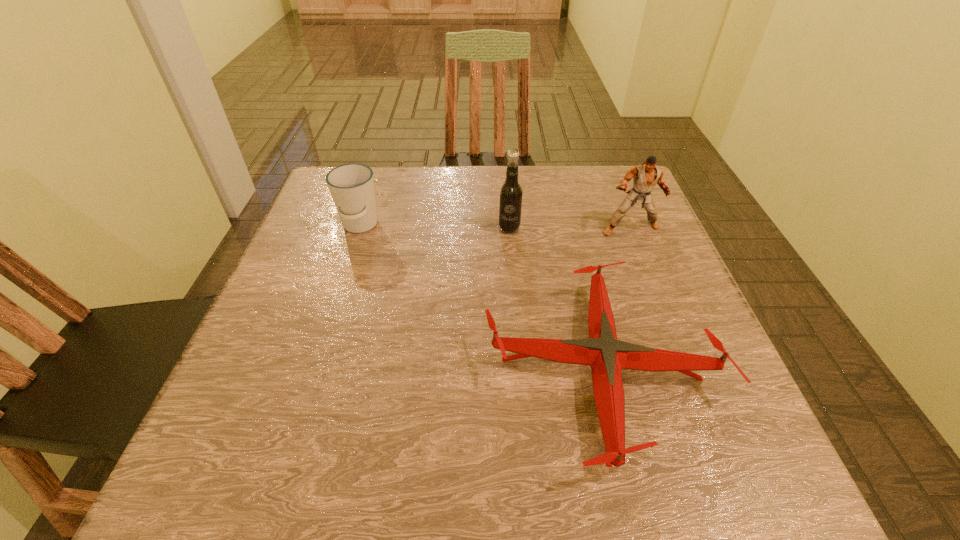
The height and width of the screenshot is (540, 960). What are the coordinates of `object at the far edge` in the screenshot? It's located at (351, 186).

Identify the location of object that is at the near edge. (607, 356).

Find the location of a particular element. The height and width of the screenshot is (540, 960). object that is at the left edge is located at coordinates [351, 186].

Where is `puncher that is at the right edge`? The width and height of the screenshot is (960, 540). puncher that is at the right edge is located at coordinates (645, 176).

Identify the location of drone that is at the right edge. The height and width of the screenshot is (540, 960). (607, 356).

The height and width of the screenshot is (540, 960). Identify the location of object situated at the far left corner. (351, 186).

At what (x,y) coordinates should I click in order to perform the action: click on object at the near right corner. Please return your answer as a coordinate pair (x, y). The height and width of the screenshot is (540, 960). Looking at the image, I should click on (607, 356).

Where is `vacant space at the far edge of the desktop`? vacant space at the far edge of the desktop is located at coordinates (422, 188).

You are a GUI agent. You are given a task and a screenshot of the screen. Output one action in this format:
    pyautogui.click(x=<x>, y=<y>)
    Task: Click on the free space at the near edge
    The image size is (960, 540).
    Given the screenshot: What is the action you would take?
    pyautogui.click(x=492, y=478)

Identify the location of vacant area at the left edge. (230, 380).